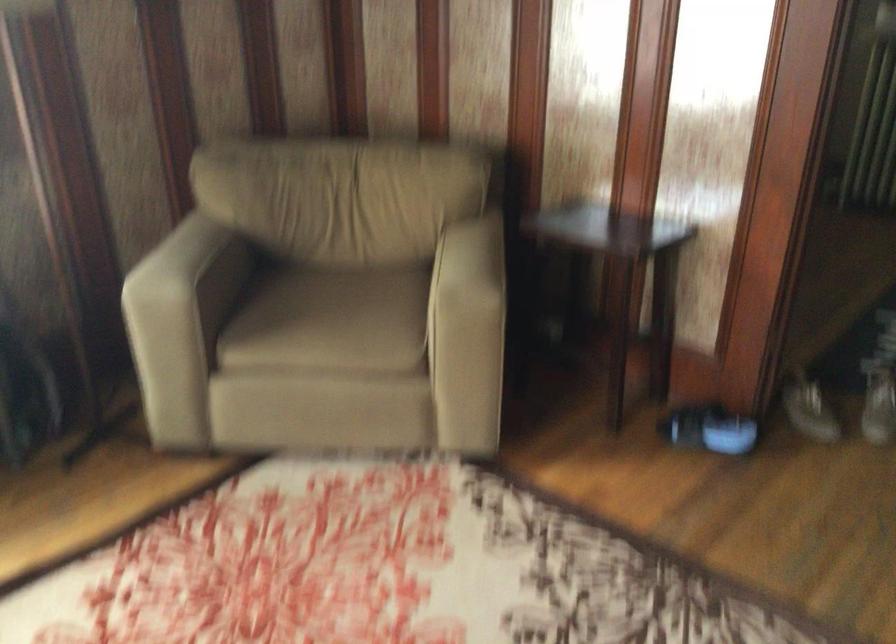
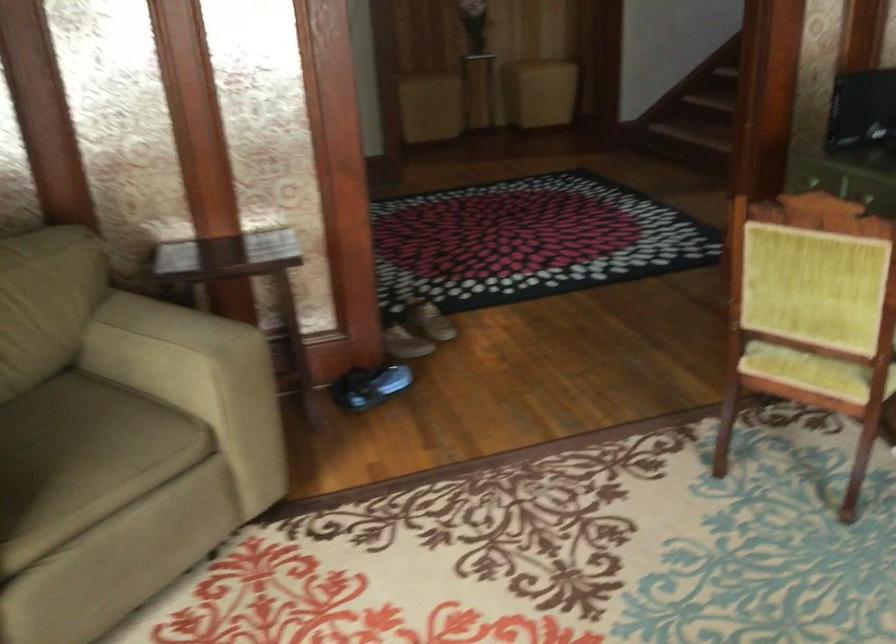
Find the pixel in the second image that matches [812,412] in the first image.

(405, 343)